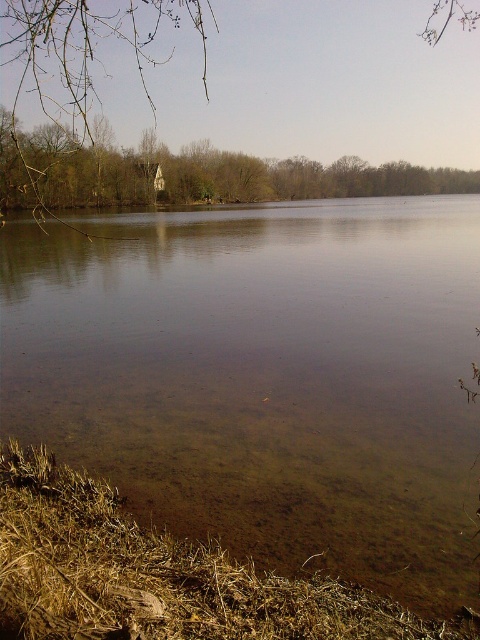
Question: Which point is farther to the camera?

Choices:
 (A) (99, 339)
 (B) (178, 156)
 (C) (13, 3)

Answer: (B)

Question: Does brown wood house at upper left have a lesser width compared to brown leafless branches at upper left?

Choices:
 (A) no
 (B) yes

Answer: (A)

Question: Can you confirm if brown wood house at upper left is bigger than brown leafless branches at upper left?

Choices:
 (A) yes
 (B) no

Answer: (B)

Question: Can you confirm if brown sedimentary river at center is smaller than brown wood house at upper left?

Choices:
 (A) no
 (B) yes

Answer: (B)

Question: Based on their relative distances, which object is farther from the brown sedimentary river at center?

Choices:
 (A) brown leafless branches at upper left
 (B) brown wood house at upper left

Answer: (B)

Question: Which of the following is the farthest from the observer?

Choices:
 (A) brown wood house at upper left
 (B) brown sedimentary river at center
 (C) brown leafless branches at upper left

Answer: (A)